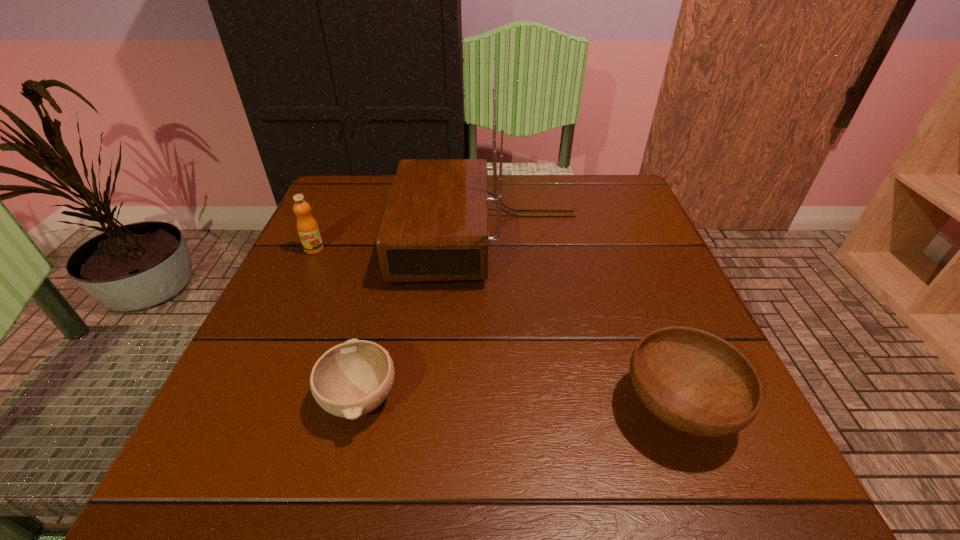
Identify the location of the tallest object. The height and width of the screenshot is (540, 960). (435, 228).

Where is `the leftmost object`? the leftmost object is located at coordinates (307, 227).

The height and width of the screenshot is (540, 960). In order to click on orange juice in this screenshot , I will do `click(307, 227)`.

Identify the location of the second shortest object. (694, 381).

At what (x,y) coordinates should I click in order to perform the action: click on the right bowl. Please return your answer as a coordinate pair (x, y). The width and height of the screenshot is (960, 540). Looking at the image, I should click on (694, 381).

The width and height of the screenshot is (960, 540). Identify the location of the shorter bowl. [351, 379].

At what (x,y) coordinates should I click in order to perform the action: click on the shortest object. Please return your answer as a coordinate pair (x, y). The image size is (960, 540). Looking at the image, I should click on tap(351, 379).

At what (x,y) coordinates should I click in order to perform the action: click on free spot located 0.100m on the front panel of the tallest object. Please return your answer as a coordinate pair (x, y). Image resolution: width=960 pixels, height=540 pixels. Looking at the image, I should click on (352, 236).

Where is `vacant space positioned on the front panel of the tallest object`? The height and width of the screenshot is (540, 960). vacant space positioned on the front panel of the tallest object is located at coordinates (312, 236).

Find the location of a particular element. The height and width of the screenshot is (540, 960). free space located on the front panel of the tallest object is located at coordinates (366, 236).